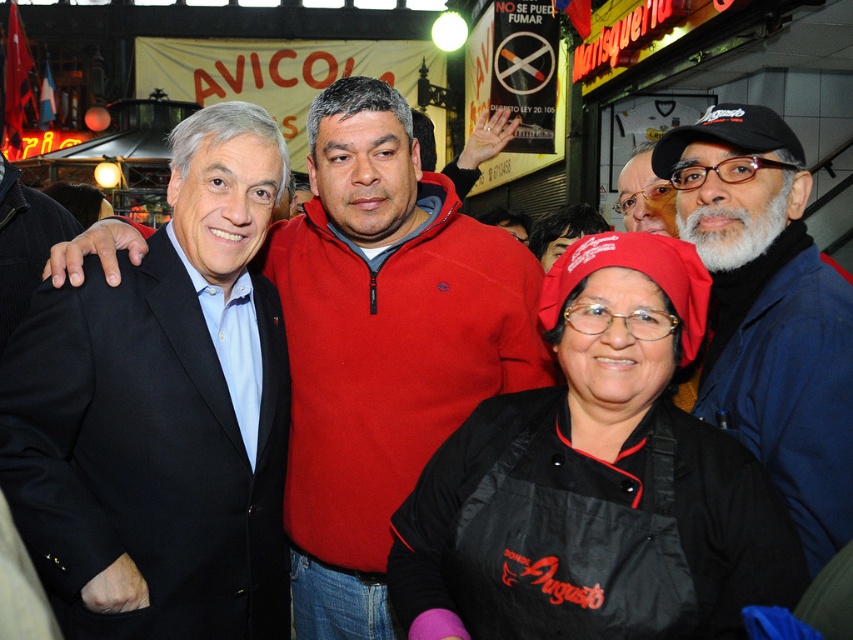
Can you confirm if blue cotton jacket at center is positioned below matte black hat at upper right?

Correct, blue cotton jacket at center is located below matte black hat at upper right.

Does point (830, 316) lie behind point (621, 192)?

No, it is not.

Is point (700, 390) positioned in front of point (660, 209)?

Yes, point (700, 390) is closer to viewer.

The image size is (853, 640). In order to click on blue cotton jacket at center in this screenshot , I will do `click(769, 312)`.

Can you confirm if black fabric apron at center is taller than smooth red sweater at center?

Yes, black fabric apron at center is taller than smooth red sweater at center.

Between black fabric apron at center and smooth red sweater at center, which one appears on the right side from the viewer's perspective?

black fabric apron at center

Who is more distant from viewer, (675, 362) or (483, 333)?

Positioned behind is point (483, 333).

You are a GUI agent. You are given a task and a screenshot of the screen. Output one action in this format:
    pyautogui.click(x=<x>, y=<y>)
    Task: Click on the black fabric apron at center
    
    Given the screenshot: What is the action you would take?
    pyautogui.click(x=595, y=480)

Is black matte suit at left closer to the viewer compared to black fabric apron at center?

No, black matte suit at left is further to the viewer.

Does black matte suit at left appear over black fabric apron at center?

Yes.

Based on the photo, who is more distant from viewer, [26,502] or [634,458]?

The point [26,502] is more distant.

Image resolution: width=853 pixels, height=640 pixels. I want to click on black matte suit at left, so click(x=161, y=412).